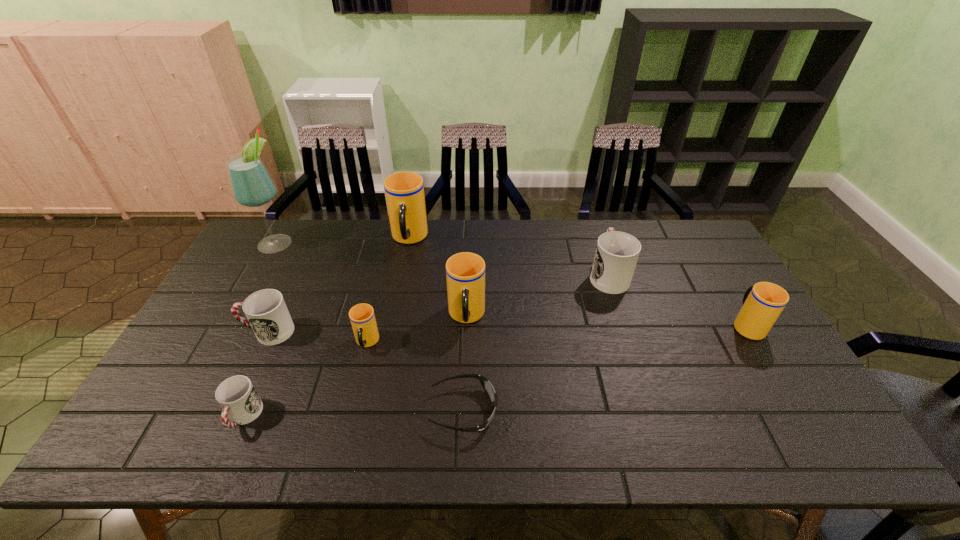
Identify the location of alcohol. (252, 186).

This screenshot has width=960, height=540. I want to click on the farthest beige cup, so click(404, 191).

The height and width of the screenshot is (540, 960). What are the coordinates of `the farthest cup` in the screenshot? It's located at tap(404, 191).

At what (x,y) coordinates should I click in order to perform the action: click on the third cup from right to left. Please return your answer as a coordinate pair (x, y). The height and width of the screenshot is (540, 960). Looking at the image, I should click on (465, 272).

You are a GUI agent. You are given a task and a screenshot of the screen. Output one action in this format:
    pyautogui.click(x=<x>, y=<y>)
    Task: Click on the second beige cup from right to left
    
    Given the screenshot: What is the action you would take?
    pyautogui.click(x=465, y=272)

Find the location of a particular element. This screenshot has width=960, height=540. the second cup from right to left is located at coordinates (616, 255).

I want to click on the third farthest object, so click(x=616, y=255).

Where is `the third biggest beige cup`? the third biggest beige cup is located at coordinates (762, 303).

This screenshot has height=540, width=960. I want to click on the rightmost beige cup, so click(762, 303).

This screenshot has height=540, width=960. Find the location of `the second biggest red cup`. the second biggest red cup is located at coordinates (266, 311).